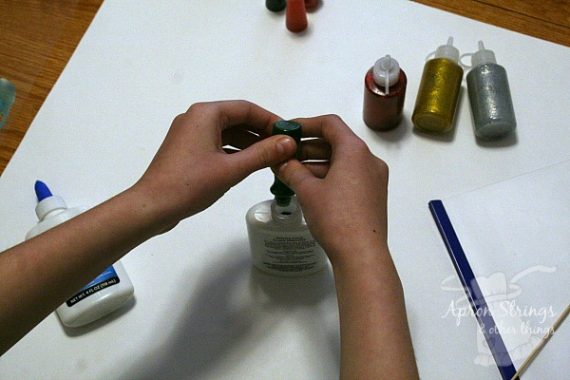
Find the location of a particular element. The height and width of the screenshot is (380, 570). glue bottle is located at coordinates (107, 285), (283, 254).